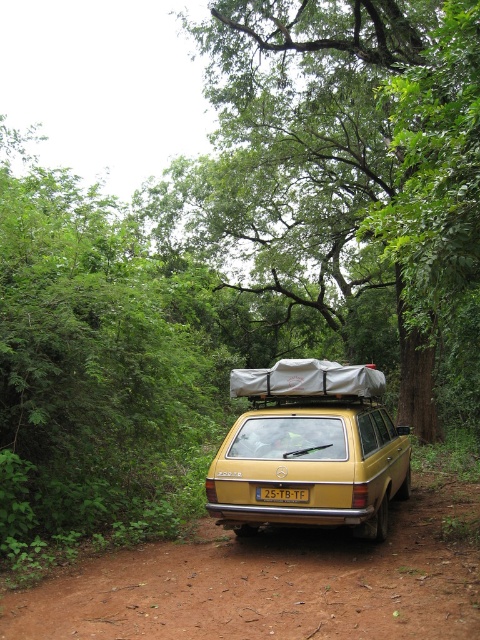
Is green leafy tree at center in front of gold matte station wagon at center?

Yes, it is.

Does green leafy tree at center appear over gold matte station wagon at center?

Indeed, green leafy tree at center is positioned over gold matte station wagon at center.

Identify the location of green leafy tree at center. (347, 180).

Is gold matte station wagon at center positioned in front of black plastic license plate at rear?

Yes, gold matte station wagon at center is closer to the viewer.

What do you see at coordinates (311, 467) in the screenshot? This screenshot has height=640, width=480. I see `gold matte station wagon at center` at bounding box center [311, 467].

Find the location of a particular element. gold matte station wagon at center is located at coordinates (311, 467).

Can you confirm if green leafy tree at center is shorter than black plastic license plate at rear?

No, green leafy tree at center is not shorter than black plastic license plate at rear.

What do you see at coordinates (347, 180) in the screenshot?
I see `green leafy tree at center` at bounding box center [347, 180].

Who is more forward, (x=363, y=240) or (x=300, y=499)?

Point (x=300, y=499) is in front.

Where is `green leafy tree at center`? This screenshot has height=640, width=480. green leafy tree at center is located at coordinates (347, 180).